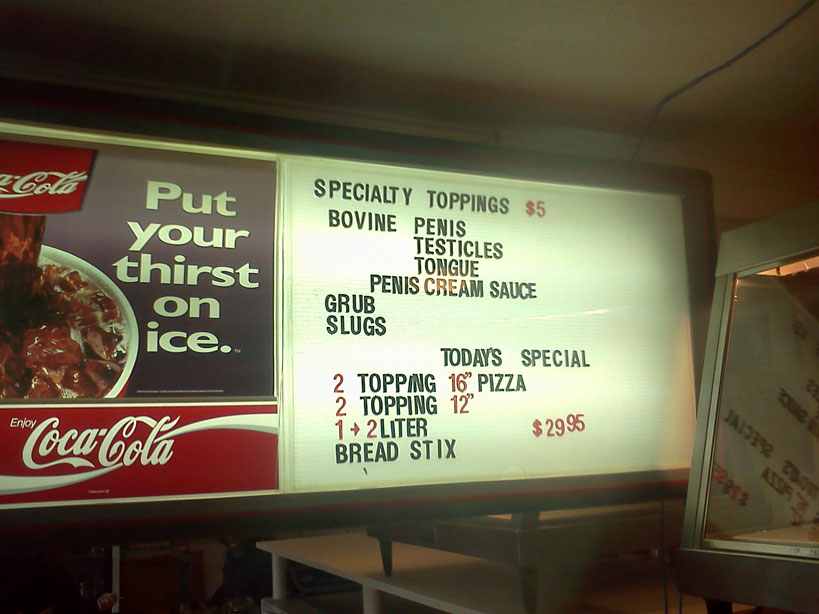
Locate an element on the screen. This screenshot has height=614, width=819. counter top is located at coordinates (332, 552).